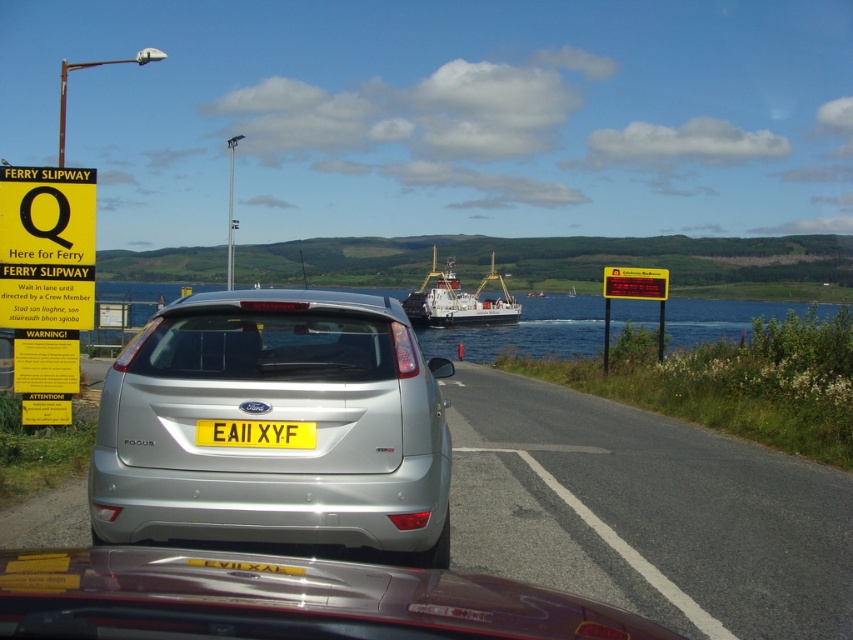
Is silver metallic hatchback at center bigger than yellow plastic sign at right?

No, silver metallic hatchback at center is not bigger than yellow plastic sign at right.

Does silver metallic hatchback at center have a lesser width compared to yellow plastic sign at right?

Indeed, silver metallic hatchback at center has a lesser width compared to yellow plastic sign at right.

Which is in front, point (347, 481) or point (624, 273)?

Positioned in front is point (347, 481).

Locate an element on the screen. The image size is (853, 640). silver metallic hatchback at center is located at coordinates (276, 420).

Is point (508, 532) more distant than point (277, 440)?

Yes, it is.

Which is behind, point (590, 410) or point (196, 433)?

The point (590, 410) is behind.

I want to click on asphalt road at center, so click(x=646, y=509).

Consider the image. Measure the distance from silver metallic car at center to shiny metallic car at center.

silver metallic car at center and shiny metallic car at center are 3.06 meters apart from each other.

Can you confirm if silver metallic car at center is smaller than shiny metallic car at center?

No, silver metallic car at center is not smaller than shiny metallic car at center.

Where is `silver metallic car at center`? Image resolution: width=853 pixels, height=640 pixels. silver metallic car at center is located at coordinates (645, 512).